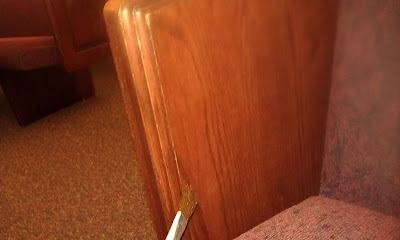
What are the coordinates of `brown carpet` in the screenshot? It's located at (105, 209), (22, 169), (111, 117), (330, 227).